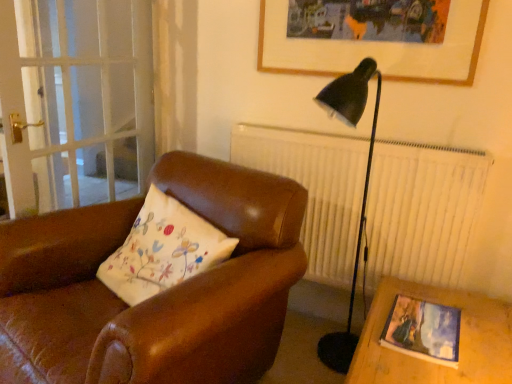
Describe the element at coordinates (423, 330) in the screenshot. I see `matte wooden picture frame at lower right, the first picture frame when ordered from bottom to top` at that location.

Locate an element on the screen. This screenshot has height=384, width=512. brown leather chair at center is located at coordinates (156, 296).

You are a GUI agent. You are given a task and a screenshot of the screen. Output one action in this format:
    pyautogui.click(x=<x>, y=<y>)
    Task: Click on the transparent glass screen door at left
    
    Given the screenshot: What is the action you would take?
    pyautogui.click(x=75, y=101)

Locate an element on the screen. wooden picture frame at upper center, which appears as the 2th picture frame when ordered from the bottom is located at coordinates (376, 48).

Is matte wooden picture frame at lower right, which ranks as the 2th picture frame in top-to-bottom order, further to the viewer compared to wooden picture frame at upper center, which is the 1th picture frame from top to bottom?

That is False.

Where is `picture frame below the wooden picture frame at upper center, which is the 1th picture frame from top to bottom (from the image's perspective)`? The image size is (512, 384). picture frame below the wooden picture frame at upper center, which is the 1th picture frame from top to bottom (from the image's perspective) is located at coordinates (423, 330).

Can you tell me how much matte wooden picture frame at lower right, the first picture frame when ordered from bottom to top, and wooden picture frame at upper center, which appears as the 2th picture frame when ordered from the bottom, differ in facing direction?

The angular difference between matte wooden picture frame at lower right, the first picture frame when ordered from bottom to top, and wooden picture frame at upper center, which appears as the 2th picture frame when ordered from the bottom, is 91.9 degrees.

Can you confirm if matte wooden picture frame at lower right, the first picture frame when ordered from bottom to top, is positioned to the right of wooden picture frame at upper center, which is the 1th picture frame from top to bottom?

Indeed, matte wooden picture frame at lower right, the first picture frame when ordered from bottom to top, is positioned on the right side of wooden picture frame at upper center, which is the 1th picture frame from top to bottom.

Which is more to the right, transparent glass screen door at left or brown leather chair at center?

brown leather chair at center.

Measure the distance from transparent glass screen door at left to brown leather chair at center.

transparent glass screen door at left and brown leather chair at center are 37.48 inches apart from each other.

Is transparent glass screen door at left aimed at brown leather chair at center?

No, transparent glass screen door at left is not facing towards brown leather chair at center.

From a real-world perspective, is transparent glass screen door at left physically located above or below brown leather chair at center?

From a real-world perspective, transparent glass screen door at left is physically above brown leather chair at center.

Measure the distance between wooden picture frame at upper center, acting as the 2th picture frame starting from the front, and matte wooden picture frame at lower right, acting as the 1th picture frame starting from the front.

A distance of 39.36 inches exists between wooden picture frame at upper center, acting as the 2th picture frame starting from the front, and matte wooden picture frame at lower right, acting as the 1th picture frame starting from the front.

Do you think wooden picture frame at upper center, the 1th picture frame positioned from the back, is within matte wooden picture frame at lower right, arranged as the second picture frame when viewed from the back, or outside of it?

The correct answer is: outside.

From the image's perspective, which one is positioned higher, wooden picture frame at upper center, acting as the 2th picture frame starting from the front, or matte wooden picture frame at lower right, acting as the 1th picture frame starting from the front?

wooden picture frame at upper center, acting as the 2th picture frame starting from the front.

Is point (275, 68) more distant than point (418, 329)?

Yes, point (275, 68) is behind point (418, 329).

Is wooden picture frame at upper center, acting as the 2th picture frame starting from the front, not inside transparent glass screen door at left?

Yes, wooden picture frame at upper center, acting as the 2th picture frame starting from the front, is located beyond the bounds of transparent glass screen door at left.

From the image's perspective, is wooden picture frame at upper center, which is the 1th picture frame from top to bottom, above or below transparent glass screen door at left?

wooden picture frame at upper center, which is the 1th picture frame from top to bottom, is situated higher than transparent glass screen door at left in the image.

From the picture: Does wooden picture frame at upper center, which appears as the 2th picture frame when ordered from the bottom, have a larger size compared to transparent glass screen door at left?

Actually, wooden picture frame at upper center, which appears as the 2th picture frame when ordered from the bottom, might be smaller than transparent glass screen door at left.

Is wooden picture frame at upper center, which appears as the 2th picture frame when ordered from the bottom, further to the viewer compared to transparent glass screen door at left?

No, the depth of wooden picture frame at upper center, which appears as the 2th picture frame when ordered from the bottom, is less than that of transparent glass screen door at left.

Considering the sizes of objects transparent glass screen door at left and matte wooden picture frame at lower right, which ranks as the 2th picture frame in top-to-bottom order, in the image provided, who is smaller, transparent glass screen door at left or matte wooden picture frame at lower right, which ranks as the 2th picture frame in top-to-bottom order,?

matte wooden picture frame at lower right, which ranks as the 2th picture frame in top-to-bottom order, is smaller.

From a real-world perspective, is transparent glass screen door at left physically above matte wooden picture frame at lower right, which ranks as the 2th picture frame in top-to-bottom order?

Yes.

Is transparent glass screen door at left looking in the opposite direction of matte wooden picture frame at lower right, which ranks as the 2th picture frame in top-to-bottom order?

transparent glass screen door at left is not turned away from matte wooden picture frame at lower right, which ranks as the 2th picture frame in top-to-bottom order.

Can you confirm if transparent glass screen door at left is thinner than matte wooden picture frame at lower right, the first picture frame when ordered from bottom to top?

Yes.

Is point (311, 72) positioned behind point (175, 311)?

Yes, it is behind point (175, 311).

How many degrees apart are the facing directions of wooden picture frame at upper center, which is the 1th picture frame from top to bottom, and brown leather chair at center?

The facing directions of wooden picture frame at upper center, which is the 1th picture frame from top to bottom, and brown leather chair at center are 19.9 degrees apart.

Would you consider wooden picture frame at upper center, which is the 1th picture frame from top to bottom, to be distant from brown leather chair at center?

wooden picture frame at upper center, which is the 1th picture frame from top to bottom, is near brown leather chair at center, not far away.

Which is more to the right, brown leather chair at center or wooden picture frame at upper center, acting as the 2th picture frame starting from the front?

From the viewer's perspective, wooden picture frame at upper center, acting as the 2th picture frame starting from the front, appears more on the right side.

Can you confirm if brown leather chair at center is smaller than wooden picture frame at upper center, the 1th picture frame positioned from the back?

No, brown leather chair at center is not smaller than wooden picture frame at upper center, the 1th picture frame positioned from the back.

Considering the sizes of objects brown leather chair at center and wooden picture frame at upper center, the 1th picture frame positioned from the back, in the image provided, who is thinner, brown leather chair at center or wooden picture frame at upper center, the 1th picture frame positioned from the back,?

Thinner between the two is wooden picture frame at upper center, the 1th picture frame positioned from the back.

Is brown leather chair at center positioned far away from wooden picture frame at upper center, which is the 1th picture frame from top to bottom?

No, brown leather chair at center is not far from wooden picture frame at upper center, which is the 1th picture frame from top to bottom.

Where is `picture frame lying above the matte wooden picture frame at lower right, acting as the 1th picture frame starting from the front (from the image's perspective)`? The height and width of the screenshot is (384, 512). picture frame lying above the matte wooden picture frame at lower right, acting as the 1th picture frame starting from the front (from the image's perspective) is located at coordinates (376, 48).

At what (x,y) coordinates should I click in order to perform the action: click on chair below the transparent glass screen door at left (from a real-world perspective). Please return your answer as a coordinate pair (x, y). The width and height of the screenshot is (512, 384). Looking at the image, I should click on (156, 296).

In the scene shown: Estimate the real-world distances between objects in this image. Which object is closer to matte wooden picture frame at lower right, acting as the 1th picture frame starting from the front, wooden picture frame at upper center, the 1th picture frame positioned from the back, or transparent glass screen door at left?

The object closer to matte wooden picture frame at lower right, acting as the 1th picture frame starting from the front, is wooden picture frame at upper center, the 1th picture frame positioned from the back.

From the image, which object appears to be nearer to wooden picture frame at upper center, the 1th picture frame positioned from the back, transparent glass screen door at left or matte wooden picture frame at lower right, which ranks as the 2th picture frame in top-to-bottom order?

matte wooden picture frame at lower right, which ranks as the 2th picture frame in top-to-bottom order, is closer to wooden picture frame at upper center, the 1th picture frame positioned from the back.

Which object lies nearer to the anchor point brown leather chair at center, wooden picture frame at upper center, which is the 1th picture frame from top to bottom, or matte wooden picture frame at lower right, the first picture frame when ordered from bottom to top?

Based on the image, matte wooden picture frame at lower right, the first picture frame when ordered from bottom to top, appears to be nearer to brown leather chair at center.

Looking at the image, which one is located further to transparent glass screen door at left, matte wooden picture frame at lower right, the first picture frame when ordered from bottom to top, or brown leather chair at center?

The object further to transparent glass screen door at left is matte wooden picture frame at lower right, the first picture frame when ordered from bottom to top.

From the image, which object appears to be nearer to wooden picture frame at upper center, which is the 1th picture frame from top to bottom, matte wooden picture frame at lower right, arranged as the second picture frame when viewed from the back, or transparent glass screen door at left?

matte wooden picture frame at lower right, arranged as the second picture frame when viewed from the back.

Based on their spatial positions, is brown leather chair at center or wooden picture frame at upper center, which is the 1th picture frame from top to bottom, further from matte wooden picture frame at lower right, the first picture frame when ordered from bottom to top?

wooden picture frame at upper center, which is the 1th picture frame from top to bottom, lies further to matte wooden picture frame at lower right, the first picture frame when ordered from bottom to top, than the other object.

When comparing their distances from transparent glass screen door at left, does wooden picture frame at upper center, the 1th picture frame positioned from the back, or brown leather chair at center seem closer?

brown leather chair at center lies closer to transparent glass screen door at left than the other object.

Estimate the real-world distances between objects in this image. Which object is further from matte wooden picture frame at lower right, which ranks as the 2th picture frame in top-to-bottom order, wooden picture frame at upper center, acting as the 2th picture frame starting from the front, or brown leather chair at center?

Based on the image, wooden picture frame at upper center, acting as the 2th picture frame starting from the front, appears to be further to matte wooden picture frame at lower right, which ranks as the 2th picture frame in top-to-bottom order.

Locate an element on the screen. Image resolution: width=512 pixels, height=384 pixels. picture frame between transparent glass screen door at left and matte wooden picture frame at lower right, which ranks as the 2th picture frame in top-to-bottom order, in the horizontal direction is located at coordinates (376, 48).

The width and height of the screenshot is (512, 384). What are the coordinates of `chair located between transparent glass screen door at left and matte wooden picture frame at lower right, arranged as the second picture frame when viewed from the back, in the left-right direction` in the screenshot? It's located at (156, 296).

Find the location of a particular element. This screenshot has height=384, width=512. chair situated between transparent glass screen door at left and wooden picture frame at upper center, the 1th picture frame positioned from the back, from left to right is located at coordinates (156, 296).

You are a GUI agent. You are given a task and a screenshot of the screen. Output one action in this format:
    pyautogui.click(x=<x>, y=<y>)
    Task: Click on the chair between wooden picture frame at upper center, the 1th picture frame positioned from the back, and matte wooden picture frame at lower right, arranged as the second picture frame when viewed from the back, from top to bottom
    
    Given the screenshot: What is the action you would take?
    pyautogui.click(x=156, y=296)